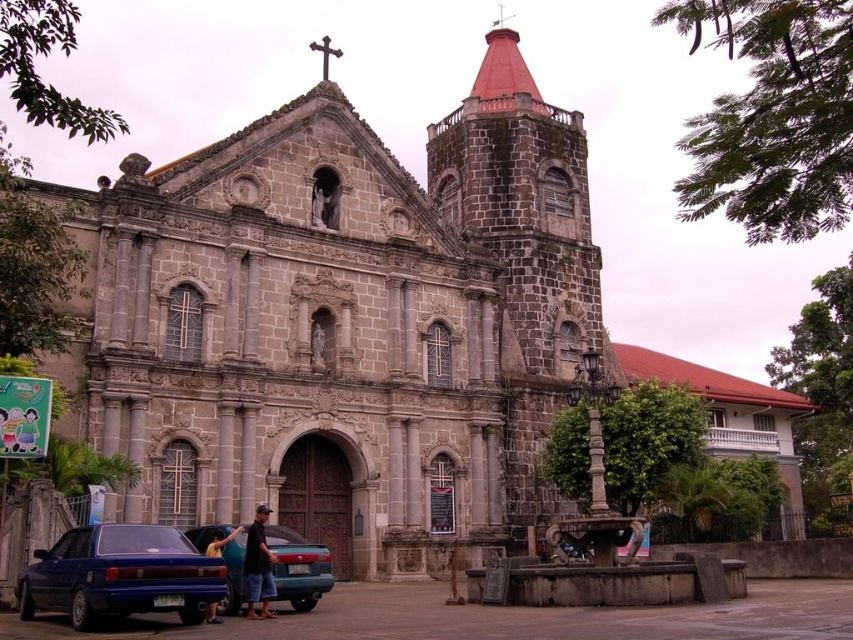
Can you confirm if dark blue denim shorts at lower center is positioned above yellow fabric shirt at lower left?

Yes.

Where is `dark blue denim shorts at lower center`? This screenshot has width=853, height=640. dark blue denim shorts at lower center is located at coordinates (258, 566).

You are a GUI agent. You are given a task and a screenshot of the screen. Output one action in this format:
    pyautogui.click(x=<x>, y=<y>)
    Task: Click on the dark blue denim shorts at lower center
    The image size is (853, 640).
    Given the screenshot: What is the action you would take?
    pyautogui.click(x=258, y=566)

Who is positioned more to the right, shiny blue sedan at lower left or blue metallic car at lower left?

blue metallic car at lower left

Is shiny blue sedan at lower left wider than blue metallic car at lower left?

Yes.

Image resolution: width=853 pixels, height=640 pixels. What do you see at coordinates (120, 576) in the screenshot?
I see `shiny blue sedan at lower left` at bounding box center [120, 576].

The image size is (853, 640). Find the location of `shiny blue sedan at lower left`. shiny blue sedan at lower left is located at coordinates (120, 576).

How much distance is there between shiny blue sedan at lower left and dark blue denim shorts at lower center?

The distance of shiny blue sedan at lower left from dark blue denim shorts at lower center is 5.73 meters.

Between shiny blue sedan at lower left and dark blue denim shorts at lower center, which one is positioned lower?

dark blue denim shorts at lower center

Does point (135, 580) lie in front of point (248, 545)?

Yes, point (135, 580) is in front of point (248, 545).

Locate an element on the screen. shiny blue sedan at lower left is located at coordinates (120, 576).